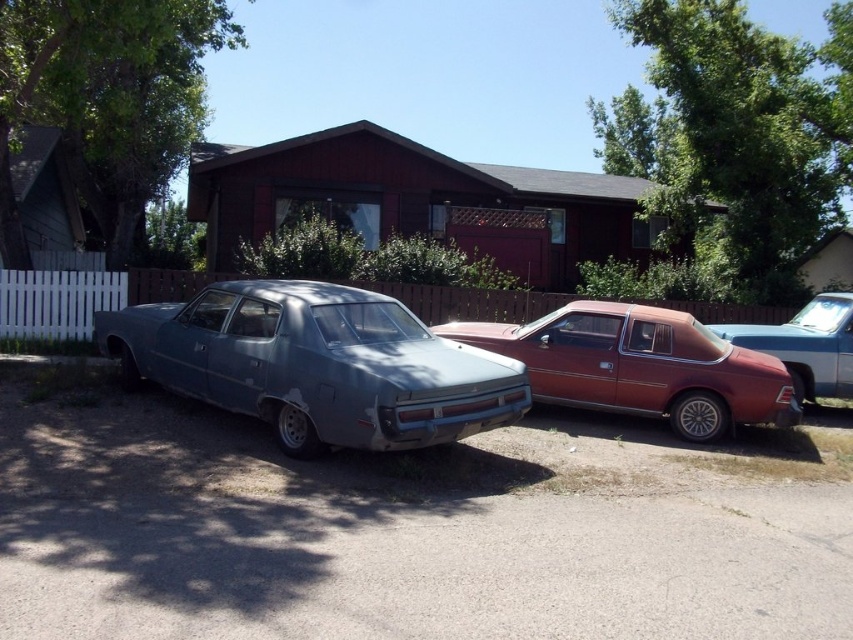
Based on the photo, you are a delivery person trying to determine which car to park behind to avoid blocking the driveway. The matte red car at center and the metallic red car at right are both in your way. Which car should you park behind to ensure you don t block the driveway, considering their heights?

The matte red car at center has a greater height compared to the metallic red car at right. Therefore, parking behind the matte red car at center would provide more clearance and avoid blocking the driveway.

Based on the photo, what is the 2D coordinate of the smooth asphalt driveway at lower center in the image?

The smooth asphalt driveway at lower center is located at the 2D coordinate point of [405,529].

You are standing at the center of the image and want to walk towards the house. Which point, point (360, 413) or point (666, 340), would you pass first?

You would pass point (360, 413) first because it is in front of point (666, 340).